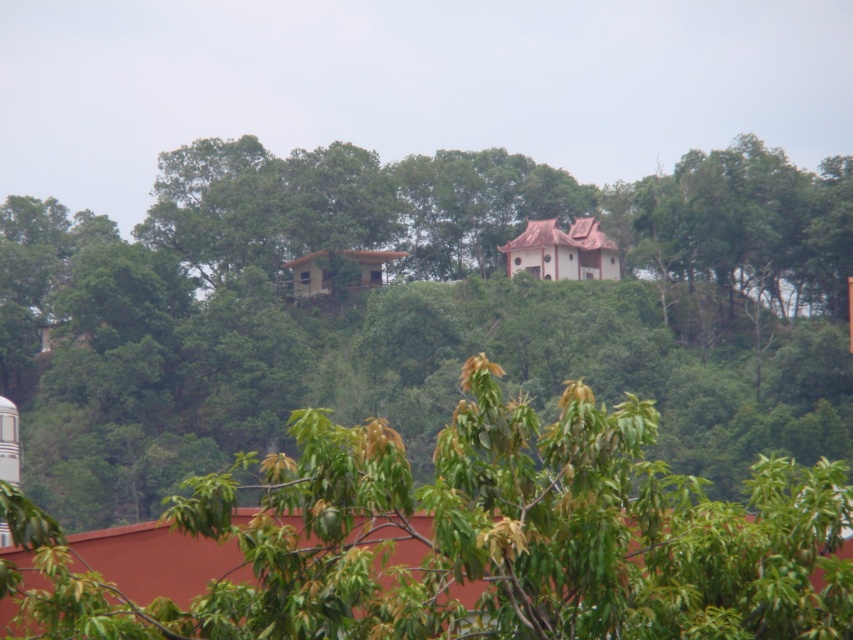
Question: Among these points, which one is farthest from the camera?

Choices:
 (A) (782, 259)
 (B) (283, 588)

Answer: (A)

Question: Which point is closer to the camera?

Choices:
 (A) (480, 420)
 (B) (184, 374)

Answer: (A)

Question: Can you confirm if green leafy tree at upper center is positioned above green leafy tree at center?

Choices:
 (A) yes
 (B) no

Answer: (A)

Question: Which point is farther to the camera?

Choices:
 (A) green leafy tree at upper center
 (B) green leafy tree at center

Answer: (A)

Question: Can you confirm if green leafy tree at upper center is positioned to the left of green leafy tree at center?

Choices:
 (A) no
 (B) yes

Answer: (A)

Question: Is green leafy tree at upper center thinner than green leafy tree at center?

Choices:
 (A) yes
 (B) no

Answer: (B)